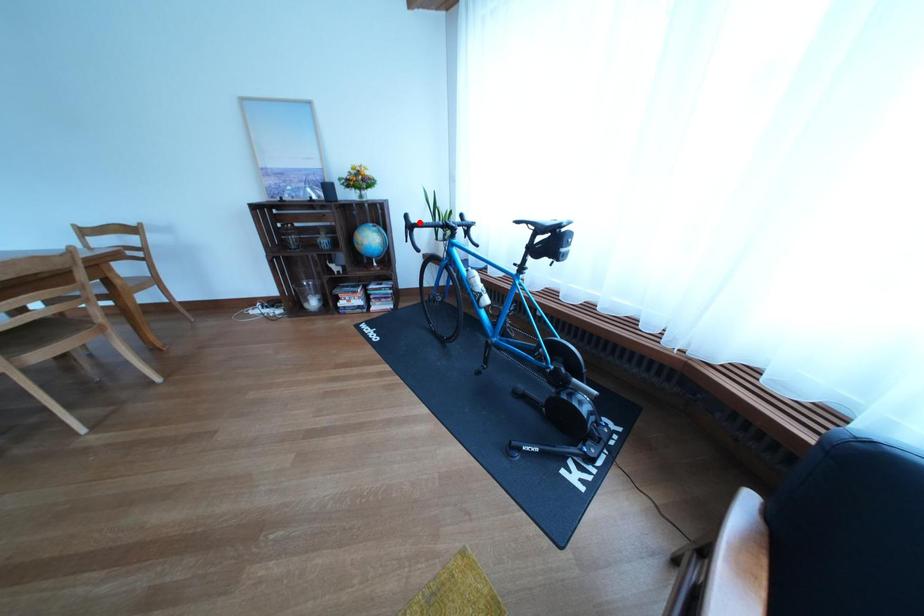
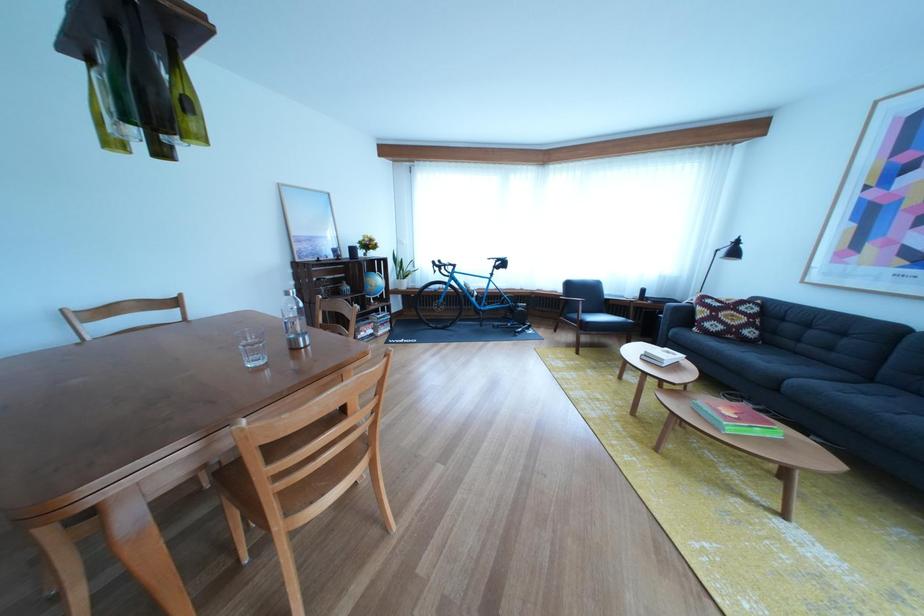
Where in the second image is the point corresponding to the highlighted location from the first image?

(445, 268)